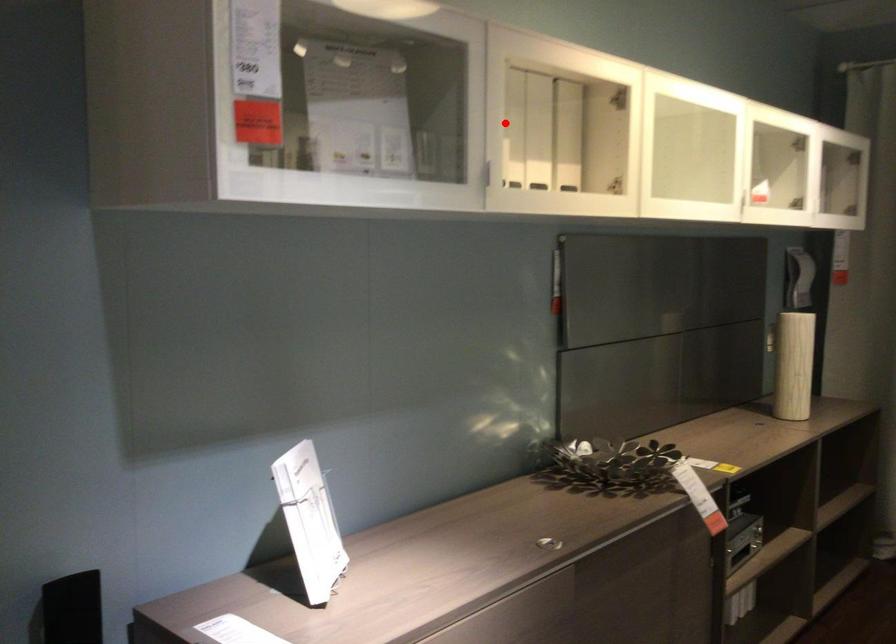
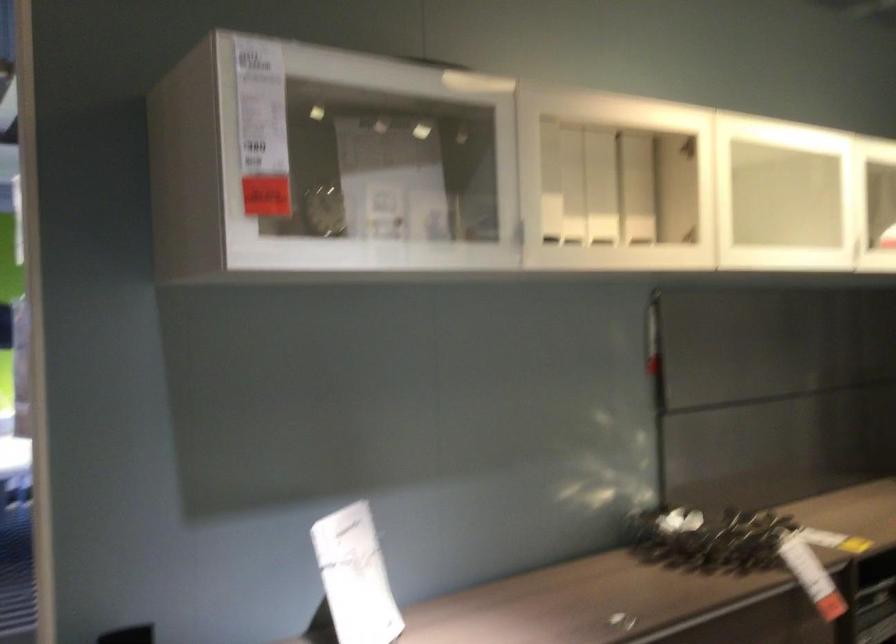
Locate, in the second image, the point that corresponds to the highlighted location in the first image.

(549, 182)